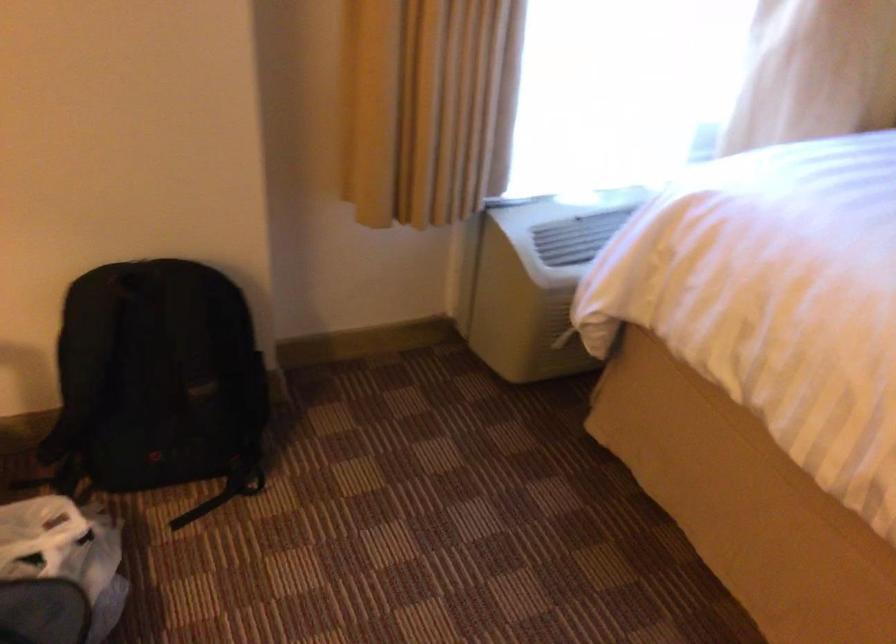
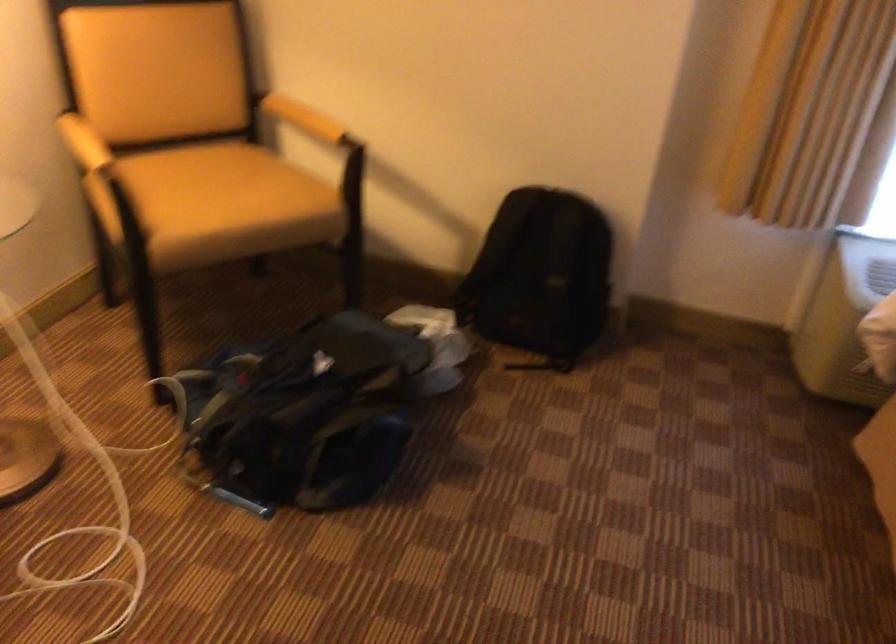
Question: The camera is either moving clockwise (left) or counter-clockwise (right) around the object. The first image is from the beginning of the video and the second image is from the end. Is the camera moving left or right when shooting the video?

Choices:
 (A) Left
 (B) Right

Answer: (B)